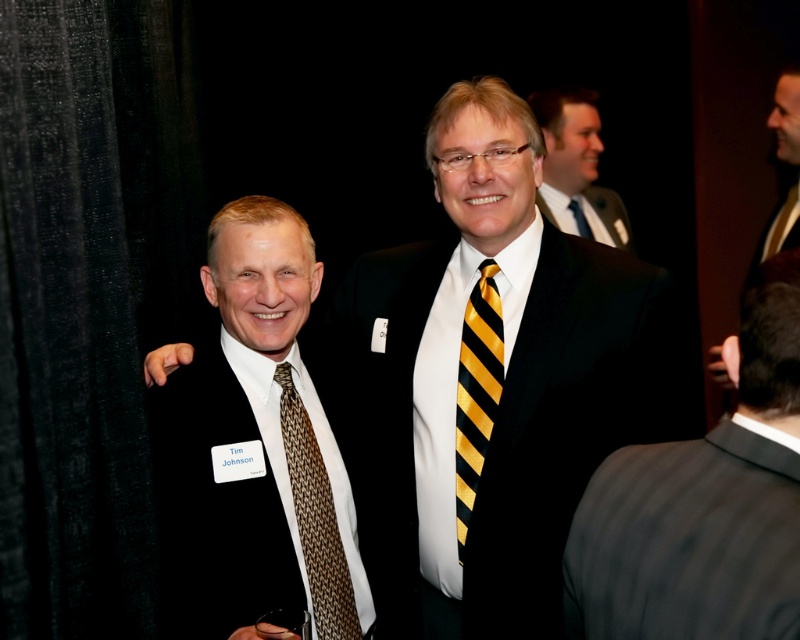
You are standing in the room where the social gathering is taking place. You notice a point marked at coordinates point (202, 476) that you want to reach. If you can move forward 5 feet, will you be able to reach that point?

The point (202, 476) is 4.76 feet away from the viewer. Since you can move forward 5 feet, you will be able to reach it.

You are a photographer at a formal event. You need to adjust the lighting to ensure both the black silk suit at left and the brown woven tie at center are well lit. Based on their positions, which object should you focus on first to ensure proper exposure?

The black silk suit at left should be focused on first since it is located above the brown woven tie at center, making it more prominent in the frame and likely requiring attention to avoid overexposure due to its dark fabric.